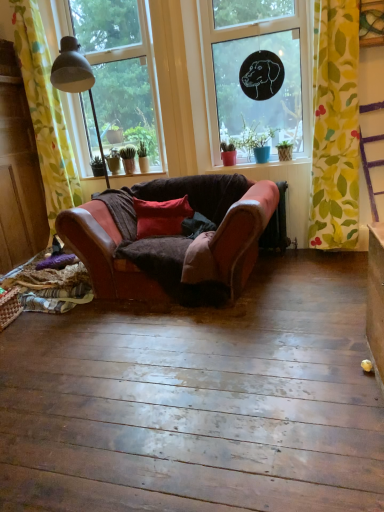
In order to click on free location above green fabric at lower left (from a real-world perspective) in this screenshot , I will do `click(124, 174)`.